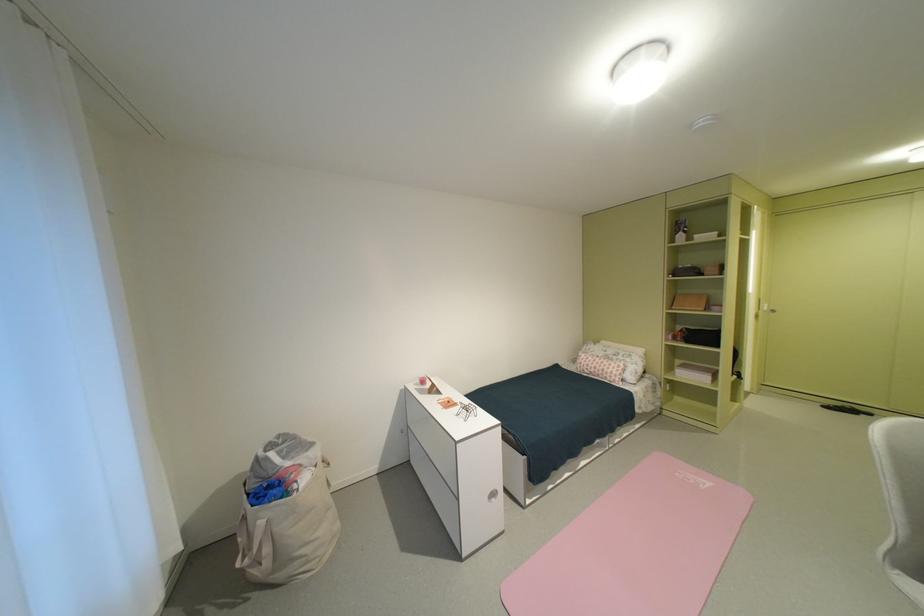
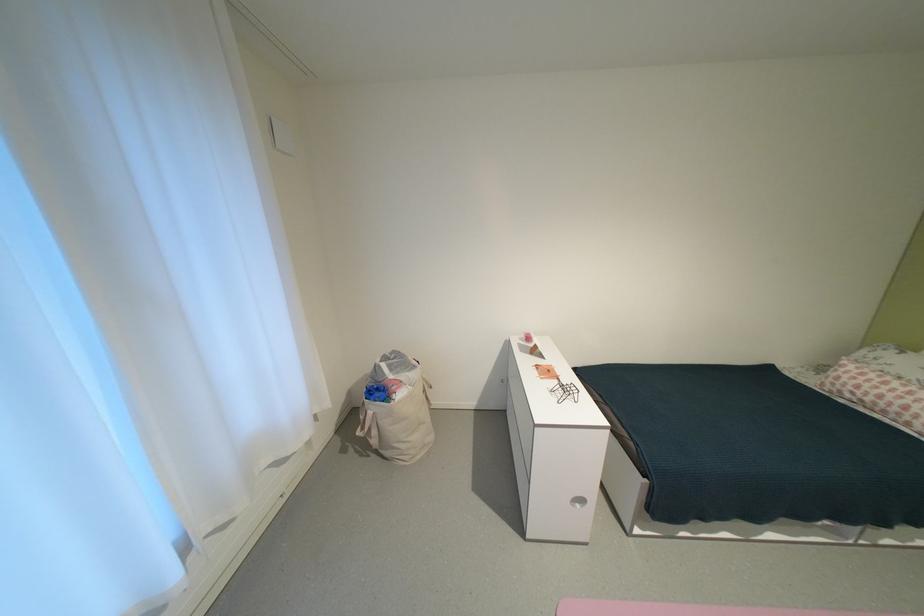
Question: The first image is from the beginning of the video and the second image is from the end. How did the camera likely rotate when shooting the video?

Choices:
 (A) Left
 (B) Right
 (C) Up
 (D) Down

Answer: (A)